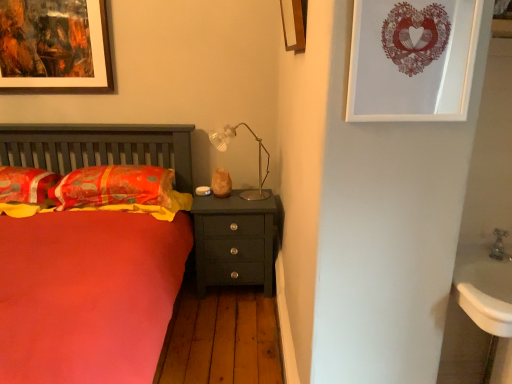
Identify the location of vacant space to the left of metallic silver faucet at lower right. This screenshot has height=384, width=512. (474, 254).